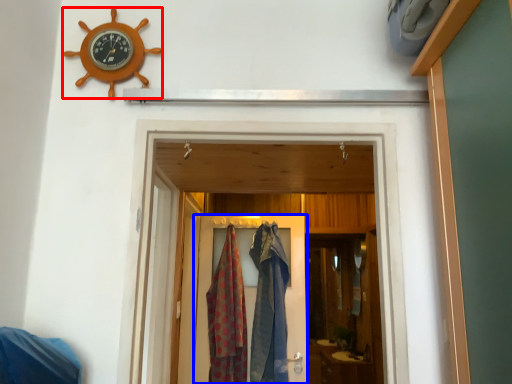
Question: Which point is closer to the camera, wall clock (highlighted by a red box) or door (highlighted by a blue box)?

Choices:
 (A) wall clock
 (B) door

Answer: (A)